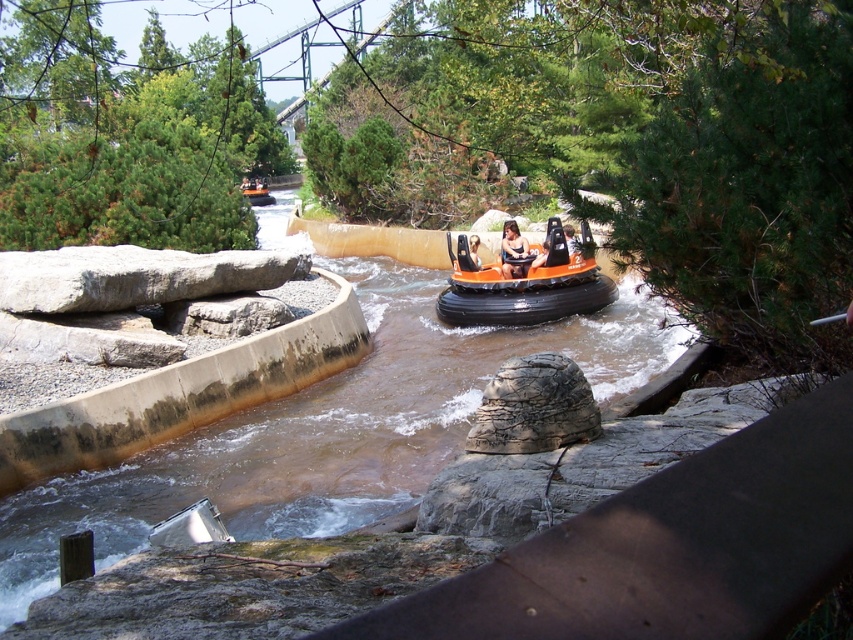
You are a park visitor trying to choose between two rafts for the water ride. The matte orange raft at center and the smooth orange raft at center are available. Based on their physical characteristics, which raft might provide more stability in the rapids?

The matte orange raft at center might be wider than smooth orange raft at center, so it could provide more stability in the rapids due to its wider base.

You are a visitor at the theme park and want to locate the orange matte bumper boat at center. According to the coordinates provided, where exactly would you find it in the image?

The orange matte bumper boat at center is located at coordinates point [527,285].